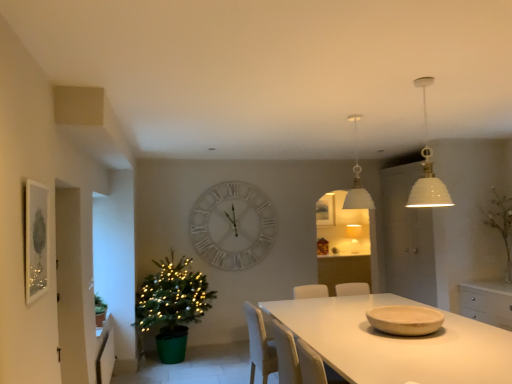
The height and width of the screenshot is (384, 512). What are the coordinates of `blank area beneath white matte pendant light at upper center, acting as the second lamp starting from the front (from a real-world perspective)` in the screenshot? It's located at (355, 314).